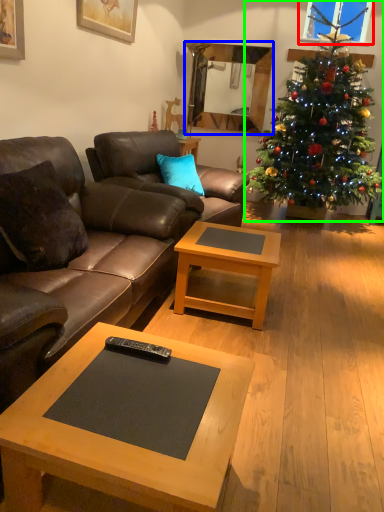
Question: Considering the real-world distances, which object is farthest from window screen (highlighted by a red box)? mirror (highlighted by a blue box) or christmas tree (highlighted by a green box)?

Choices:
 (A) mirror
 (B) christmas tree

Answer: (B)